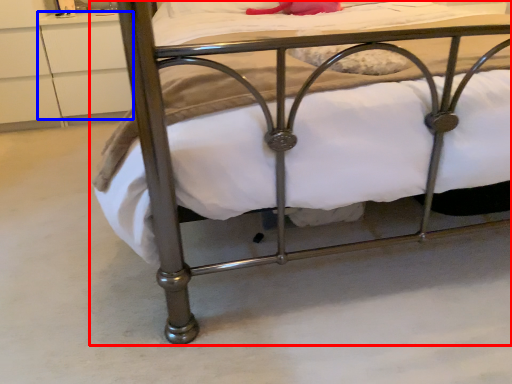
Question: Which object appears closest to the camera in this image, bed (highlighted by a red box) or drawer (highlighted by a blue box)?

Choices:
 (A) bed
 (B) drawer

Answer: (A)